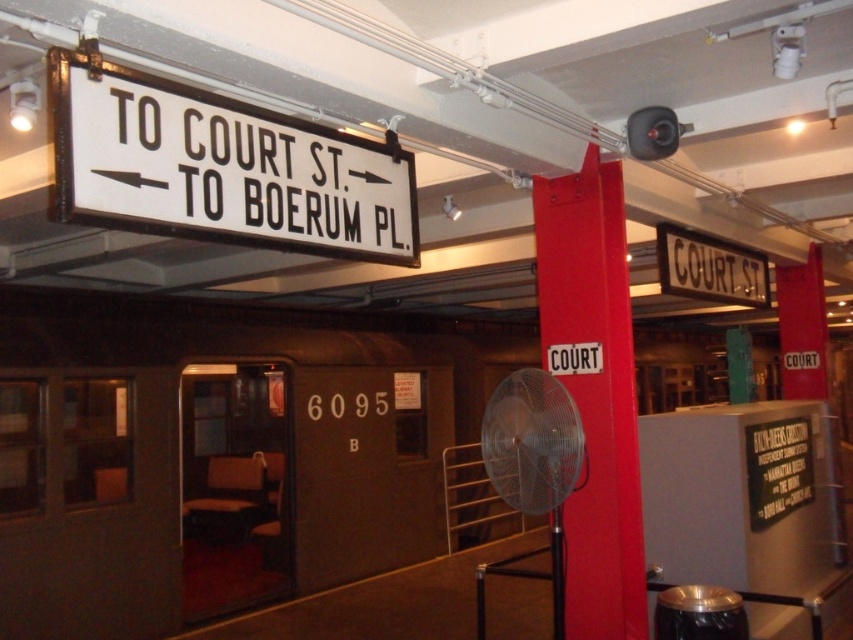
Question: Can you confirm if white plastic sign at upper center is wider than red matte signpost at center?

Choices:
 (A) no
 (B) yes

Answer: (B)

Question: Considering the relative positions of white plastic sign at upper center and red matte signpost at center in the image provided, where is white plastic sign at upper center located with respect to red matte signpost at center?

Choices:
 (A) left
 (B) right

Answer: (A)

Question: Is white plastic sign at upper center in front of red matte signpost at center?

Choices:
 (A) no
 (B) yes

Answer: (B)

Question: Among these objects, which one is farthest from the camera?

Choices:
 (A) red matte signpost at center
 (B) white plastic sign at upper center

Answer: (A)